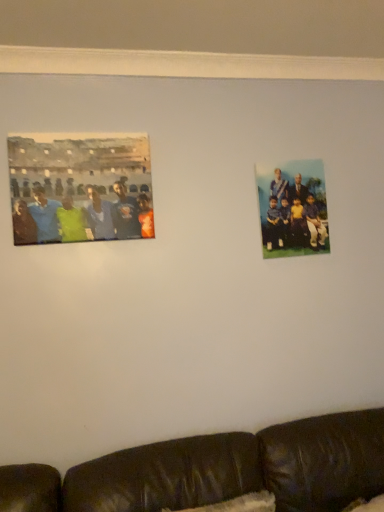
Question: Considering the relative sizes of matte green shirt at left, which is the second person from back to front, and black leather couch at lower center in the image provided, is matte green shirt at left, which is the second person from back to front, thinner than black leather couch at lower center?

Choices:
 (A) yes
 (B) no

Answer: (A)

Question: Is matte green shirt at left, placed as the 1th person when sorted from left to right, positioned in front of black leather couch at lower center?

Choices:
 (A) yes
 (B) no

Answer: (B)

Question: Is matte green shirt at left, which is the 2th person from right to left, facing away from black leather couch at lower center?

Choices:
 (A) yes
 (B) no

Answer: (B)

Question: From the image's perspective, is matte green shirt at left, the first person in the front-to-back sequence, beneath black leather couch at lower center?

Choices:
 (A) no
 (B) yes

Answer: (A)

Question: Would you say matte green shirt at left, which is the second person from back to front, is inside or outside blue fabric group at upper right, the second person when ordered from left to right?

Choices:
 (A) inside
 (B) outside

Answer: (B)

Question: Considering the positions of matte green shirt at left, placed as the 1th person when sorted from left to right, and blue fabric group at upper right, which is the second person in front-to-back order, in the image, is matte green shirt at left, placed as the 1th person when sorted from left to right, wider or thinner than blue fabric group at upper right, which is the second person in front-to-back order,?

Choices:
 (A) wide
 (B) thin

Answer: (A)

Question: From the image's perspective, relative to blue fabric group at upper right, which is counted as the 1th person, starting from the right, is matte green shirt at left, which is the second person from back to front, above or below?

Choices:
 (A) below
 (B) above

Answer: (B)

Question: Based on their positions, is matte green shirt at left, which is the second person from back to front, located to the left or right of blue fabric group at upper right, which is the second person in front-to-back order?

Choices:
 (A) right
 (B) left

Answer: (B)

Question: From the image's perspective, is blue fabric group at upper right, which is the second person in front-to-back order, positioned above or below black leather couch at lower center?

Choices:
 (A) above
 (B) below

Answer: (A)

Question: Is blue fabric group at upper right, which is the second person in front-to-back order, bigger or smaller than black leather couch at lower center?

Choices:
 (A) big
 (B) small

Answer: (B)

Question: Is blue fabric group at upper right, which is the 1th person in back-to-front order, taller or shorter than black leather couch at lower center?

Choices:
 (A) tall
 (B) short

Answer: (B)

Question: From a real-world perspective, is blue fabric group at upper right, which is counted as the 1th person, starting from the right, above or below black leather couch at lower center?

Choices:
 (A) below
 (B) above

Answer: (B)

Question: From a real-world perspective, relative to matte green shirt at left, the first person in the front-to-back sequence, is blue fabric group at upper right, which is the 1th person in back-to-front order, vertically above or below?

Choices:
 (A) below
 (B) above

Answer: (A)

Question: Is blue fabric group at upper right, which is counted as the 1th person, starting from the right, taller or shorter than matte green shirt at left, the first person in the front-to-back sequence?

Choices:
 (A) short
 (B) tall

Answer: (B)